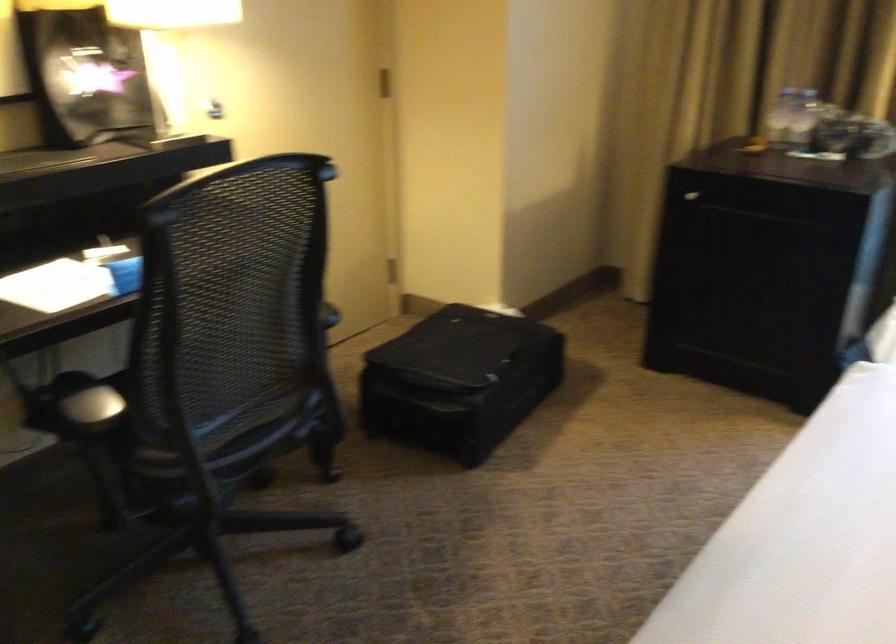
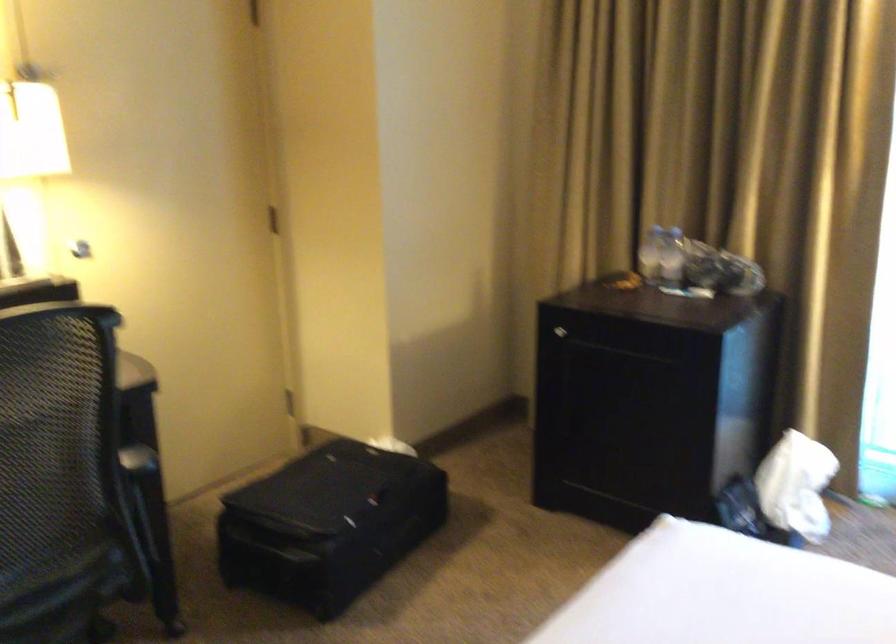
In the second image, find the point that corresponds to point (797, 120) in the first image.

(670, 257)